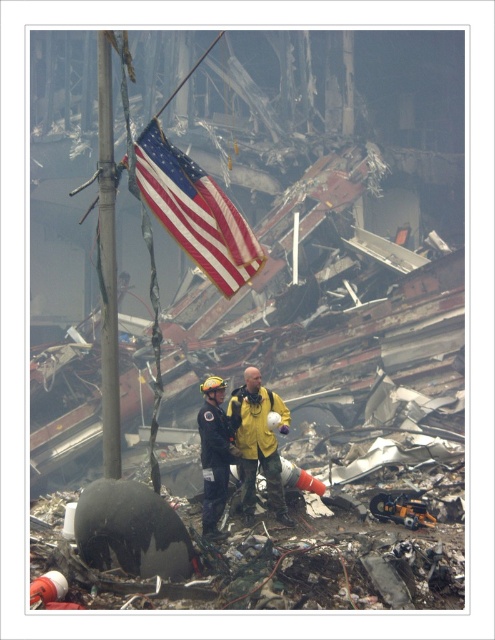
Question: Is american flag at center smaller than black matte uniform at center?

Choices:
 (A) yes
 (B) no

Answer: (B)

Question: Which of the following is the farthest from the observer?

Choices:
 (A) (208, 417)
 (B) (247, 483)
 (C) (112, 323)

Answer: (B)

Question: Is metallic pole at center thinner than yellow matte jacket at center?

Choices:
 (A) yes
 (B) no

Answer: (A)

Question: Which of the following is the farthest from the observer?

Choices:
 (A) american flag at center
 (B) yellow matte jacket at center
 (C) metallic pole at center

Answer: (B)

Question: Can you confirm if american flag at center is positioned below yellow matte jacket at center?

Choices:
 (A) no
 (B) yes

Answer: (A)

Question: Among these objects, which one is farthest from the camera?

Choices:
 (A) black matte uniform at center
 (B) american flag at center
 (C) yellow matte jacket at center

Answer: (C)